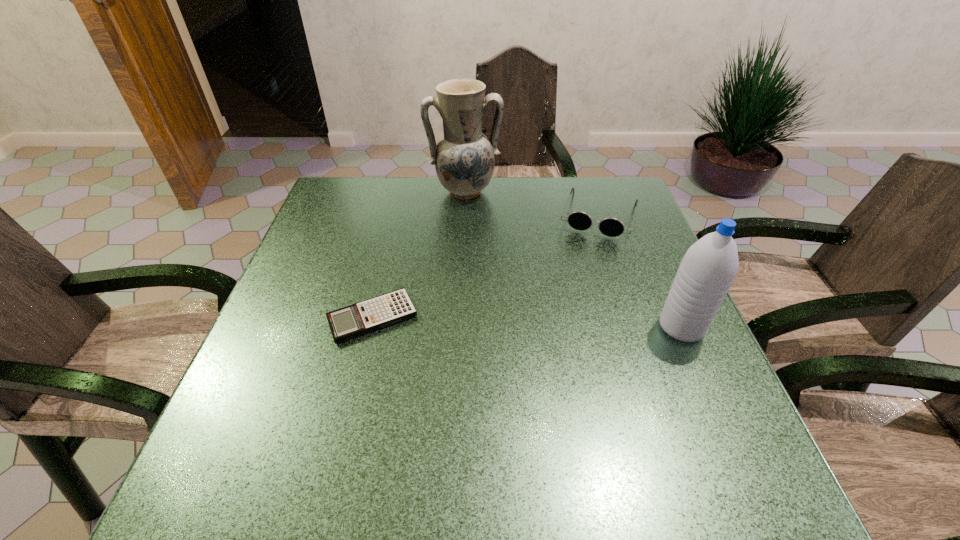
At what (x,y) coordinates should I click in order to perform the action: click on vacant space at the left edge of the desktop. Please return your answer as a coordinate pair (x, y). This screenshot has width=960, height=540. Looking at the image, I should click on (335, 298).

This screenshot has height=540, width=960. I want to click on vacant region at the right edge of the desktop, so coord(632,289).

In the image, there is a desktop. Where is `vacant space at the far left corner`? The image size is (960, 540). vacant space at the far left corner is located at coordinates (361, 180).

Image resolution: width=960 pixels, height=540 pixels. What are the coordinates of `vacant space at the near left corner` in the screenshot? It's located at (284, 426).

You are a GUI agent. You are given a task and a screenshot of the screen. Output one action in this format:
    pyautogui.click(x=<x>, y=<y>)
    Task: Click on the vacant region at the far right corner
    
    Given the screenshot: What is the action you would take?
    pyautogui.click(x=580, y=193)

Locate an element on the screen. The image size is (960, 540). empty space between the water bottle and the second shortest object is located at coordinates (640, 272).

This screenshot has height=540, width=960. Find the location of `vacant area that lies between the second tallest object and the pottery`. vacant area that lies between the second tallest object and the pottery is located at coordinates (573, 259).

At what (x,y) coordinates should I click in order to perform the action: click on vacant space that's between the shortest object and the pottery. Please return your answer as a coordinate pair (x, y). The image size is (960, 540). Looking at the image, I should click on (419, 254).

At what (x,y) coordinates should I click in order to perform the action: click on vacant point located between the third shortest object and the sunglasses. Please return your answer as a coordinate pair (x, y). Looking at the image, I should click on (640, 272).

This screenshot has width=960, height=540. I want to click on free spot between the water bottle and the sunglasses, so click(640, 272).